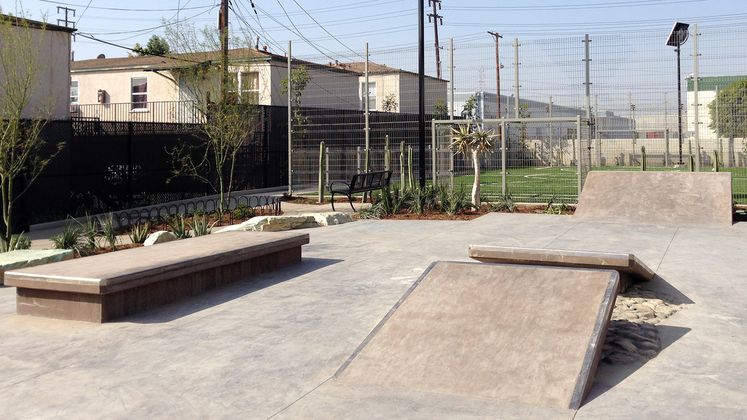
Identify the location of light. (678, 34).